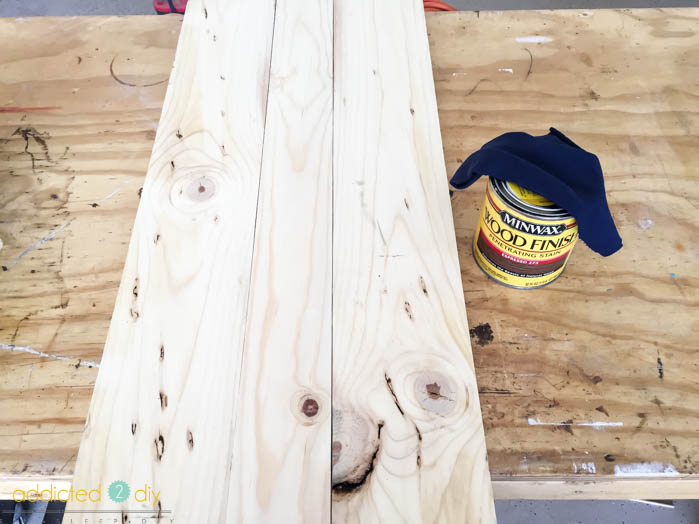
The width and height of the screenshot is (699, 524). What are the coordinates of `floor` in the screenshot? It's located at (559, 508), (70, 7).